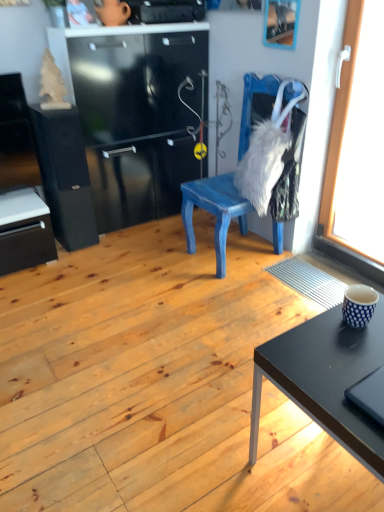
Describe the element at coordinates (65, 175) in the screenshot. I see `black matte file cabinet at left` at that location.

The width and height of the screenshot is (384, 512). Describe the element at coordinates (359, 305) in the screenshot. I see `blue dotted cup at right` at that location.

In order to face blue dotted cup at right, should I rotate leftwards or rightwards?

You should look right and rotate roughly 21.621 degrees.

You are a GUI agent. You are given a task and a screenshot of the screen. Output one action in this format:
    pyautogui.click(x=<x>, y=<y>)
    Task: Click on the wooden picture frame at upper center
    
    Given the screenshot: What is the action you would take?
    pyautogui.click(x=281, y=23)

What do you see at coordinates (281, 23) in the screenshot? I see `wooden picture frame at upper center` at bounding box center [281, 23].

Identify the location of black matte laptop at lower right. The image size is (384, 512). (369, 395).

Identify the location of blue painted wood chair at center. The width and height of the screenshot is (384, 512). (214, 211).

From a real-world perspective, is black matte file cabinet at left beneath black matte desk at lower right?

No.

Can you confirm if black matte file cabinet at left is taller than black matte desk at lower right?

Correct, black matte file cabinet at left is much taller as black matte desk at lower right.

Which is in front, point (71, 147) or point (339, 434)?

The point (339, 434) is in front.

Would you say black matte file cabinet at left is a long distance from black matte desk at lower right?

Absolutely, black matte file cabinet at left is distant from black matte desk at lower right.

Which is behind, black matte laptop at lower right or black matte file cabinet at left?

black matte file cabinet at left is behind.

Does black matte laptop at lower right have a lesser width compared to black matte file cabinet at left?

Yes, black matte laptop at lower right is thinner than black matte file cabinet at left.

Where is `file cabinet that appears on the left of black matte laptop at lower right`? file cabinet that appears on the left of black matte laptop at lower right is located at coordinates (65, 175).

Is black matte laptop at lower right aimed at black matte file cabinet at left?

No, black matte laptop at lower right is not oriented towards black matte file cabinet at left.

Considering the positions of points (324, 429) and (358, 305), is point (324, 429) closer to camera compared to point (358, 305)?

That is True.

Which object is wider, black matte desk at lower right or blue dotted cup at right?

black matte desk at lower right.

In terms of height, does black matte desk at lower right look taller or shorter compared to blue dotted cup at right?

Clearly, black matte desk at lower right is taller compared to blue dotted cup at right.

Is black matte desk at lower right oriented towards blue dotted cup at right?

No, black matte desk at lower right is not aimed at blue dotted cup at right.

Is wooden picture frame at upper center facing towards blue dotted cup at right?

No, wooden picture frame at upper center is not facing towards blue dotted cup at right.

From the image's perspective, is wooden picture frame at upper center located above or below blue dotted cup at right?

Clearly, from the image's perspective, wooden picture frame at upper center is above blue dotted cup at right.

At what (x,y) coordinates should I click in order to perform the action: click on picture frame located above the blue dotted cup at right (from a real-world perspective). Please return your answer as a coordinate pair (x, y). The width and height of the screenshot is (384, 512). Looking at the image, I should click on (281, 23).

Does wooden picture frame at upper center come in front of blue dotted cup at right?

No, wooden picture frame at upper center is further to the viewer.

Does point (266, 6) come in front of point (351, 400)?

No, it is not.

Considering the relative positions of wooden picture frame at upper center and black matte laptop at lower right in the image provided, is wooden picture frame at upper center to the right of black matte laptop at lower right from the viewer's perspective?

No, wooden picture frame at upper center is not to the right of black matte laptop at lower right.

Locate an element on the screen. picture frame on the left of black matte laptop at lower right is located at coordinates (281, 23).

From their relative heights in the image, would you say blue painted wood chair at center is taller or shorter than black matte laptop at lower right?

Considering their sizes, blue painted wood chair at center has more height than black matte laptop at lower right.

Does blue painted wood chair at center lie in front of black matte laptop at lower right?

No.

Consider the image. From the image's perspective, is blue painted wood chair at center below black matte laptop at lower right?

No, from the image's perspective, blue painted wood chair at center is not below black matte laptop at lower right.

Does blue painted wood chair at center turn towards black matte laptop at lower right?

No, blue painted wood chair at center is not aimed at black matte laptop at lower right.

Which of these two, black matte desk at lower right or blue painted wood chair at center, is smaller?

With smaller size is black matte desk at lower right.

How different are the orientations of black matte desk at lower right and blue painted wood chair at center in degrees?

0.944 degrees.

Choose the correct answer: Is black matte desk at lower right inside blue painted wood chair at center or outside it?

black matte desk at lower right is not inside blue painted wood chair at center, it's outside.

At what (x,y) coordinates should I click in order to perform the action: click on chair on the left side of black matte desk at lower right. Please return your answer as a coordinate pair (x, y). Looking at the image, I should click on (214, 211).

Find the location of a particular element. desk in front of the black matte file cabinet at left is located at coordinates (326, 379).

Locate an element on the screen. The height and width of the screenshot is (512, 384). file cabinet above the black matte laptop at lower right (from the image's perspective) is located at coordinates (65, 175).

Based on the photo, when comparing their distances from black matte desk at lower right, does blue dotted cup at right or wooden picture frame at upper center seem further?

Among the two, wooden picture frame at upper center is located further to black matte desk at lower right.

Estimate the real-world distances between objects in this image. Which object is further from transparent glass window at right, black matte file cabinet at left or blue painted wood chair at center?

black matte file cabinet at left is positioned further to the anchor transparent glass window at right.

Which object lies further to the anchor point black matte file cabinet at left, wooden picture frame at upper center or transparent glass window at right?

transparent glass window at right is further to black matte file cabinet at left.

Estimate the real-world distances between objects in this image. Which object is further from black matte desk at lower right, black matte laptop at lower right or blue painted wood chair at center?

blue painted wood chair at center is positioned further to the anchor black matte desk at lower right.

Which object lies nearer to the anchor point black matte laptop at lower right, black matte desk at lower right or blue dotted cup at right?

black matte desk at lower right is closer to black matte laptop at lower right.

Looking at the image, which one is located further to black matte desk at lower right, transparent glass window at right or blue painted wood chair at center?

transparent glass window at right lies further to black matte desk at lower right than the other object.

Looking at the image, which one is located further to black matte file cabinet at left, wooden picture frame at upper center or blue dotted cup at right?

blue dotted cup at right is positioned further to the anchor black matte file cabinet at left.

Based on their spatial positions, is wooden picture frame at upper center or black matte desk at lower right further from blue painted wood chair at center?

Based on the image, black matte desk at lower right appears to be further to blue painted wood chair at center.

The image size is (384, 512). What are the coordinates of `laptop that lies between transparent glass window at right and black matte desk at lower right from top to bottom` in the screenshot? It's located at (369, 395).

What are the coordinates of `coffee cup between wooden picture frame at upper center and black matte laptop at lower right in the vertical direction` in the screenshot? It's located at coord(359,305).

The width and height of the screenshot is (384, 512). I want to click on window that lies between wooden picture frame at upper center and black matte laptop at lower right from top to bottom, so (358, 139).

Image resolution: width=384 pixels, height=512 pixels. Find the location of `laptop that lies between wooden picture frame at upper center and black matte desk at lower right from top to bottom`. laptop that lies between wooden picture frame at upper center and black matte desk at lower right from top to bottom is located at coordinates (369, 395).